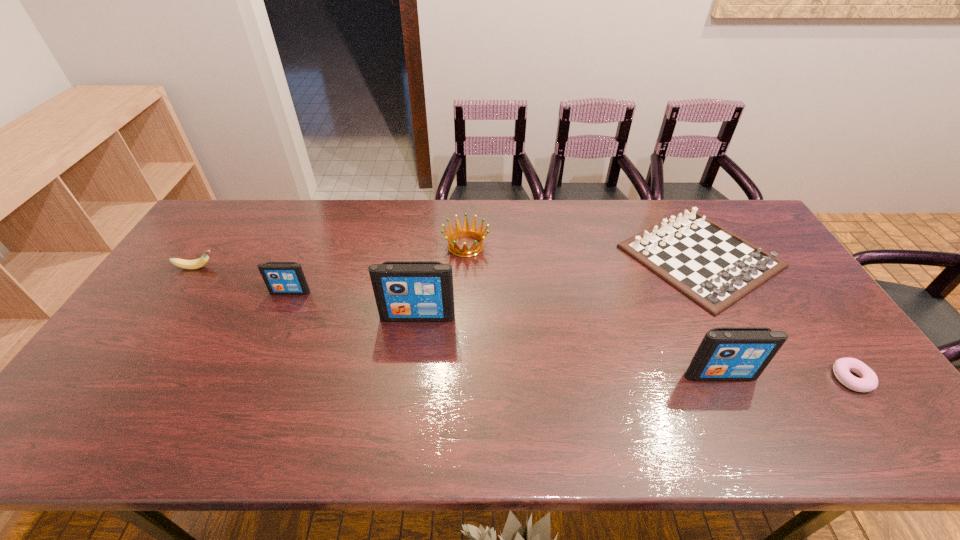
Identify the location of object at the left edge. (197, 263).

Find the location of a particular element. chessboard that is positioned at the right edge is located at coordinates pyautogui.click(x=712, y=266).

Image resolution: width=960 pixels, height=540 pixels. I want to click on pastry that is at the right edge, so click(x=868, y=381).

Identify the location of object located at the far right corner. The width and height of the screenshot is (960, 540). (712, 266).

Where is `object that is at the near right corner`? object that is at the near right corner is located at coordinates (868, 381).

Image resolution: width=960 pixels, height=540 pixels. Identify the location of vacant space at the far edge of the desktop. (317, 227).

The height and width of the screenshot is (540, 960). Find the location of `vacant space at the near edge of the desktop`. vacant space at the near edge of the desktop is located at coordinates (665, 391).

In the image, there is a desktop. At what (x,y) coordinates should I click in order to perform the action: click on vacant space at the left edge. Please return your answer as a coordinate pair (x, y). Looking at the image, I should click on (209, 291).

Image resolution: width=960 pixels, height=540 pixels. In the image, there is a desktop. Identify the location of free space at the far left corner. (228, 201).

You are a GUI agent. You are given a task and a screenshot of the screen. Output one action in this format:
    pyautogui.click(x=<x>, y=<y>)
    Task: Click on the blank region between the leftmost object and the crown
    The width and height of the screenshot is (960, 540).
    Given the screenshot: What is the action you would take?
    pyautogui.click(x=331, y=257)